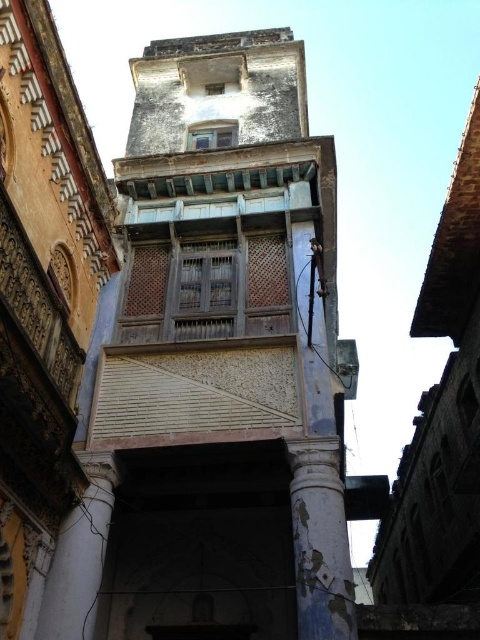
The image size is (480, 640). In order to click on blue painted wood bell tower at center in this screenshot , I will do `click(214, 368)`.

Can you confirm if blue painted wood bell tower at center is thinner than white marble pillar at lower left?

Incorrect, blue painted wood bell tower at center's width is not less than white marble pillar at lower left's.

Is point (218, 616) in front of point (84, 556)?

No, it is behind (84, 556).

Locate an element on the screen. This screenshot has width=480, height=640. blue painted wood bell tower at center is located at coordinates (214, 368).

Does peeling blue paint column at lower right have a greater width compared to white marble pillar at lower left?

Correct, the width of peeling blue paint column at lower right exceeds that of white marble pillar at lower left.

Is peeling blue paint column at lower right taller than white marble pillar at lower left?

Indeed, peeling blue paint column at lower right has a greater height compared to white marble pillar at lower left.

Which is in front, point (321, 605) or point (76, 508)?

Point (321, 605)

Where is `peeling blue paint column at lower right`? The height and width of the screenshot is (640, 480). peeling blue paint column at lower right is located at coordinates (320, 540).

Between blue painted wood bell tower at center and peeling blue paint column at lower right, which one has less height?

Standing shorter between the two is peeling blue paint column at lower right.

Is point (315, 138) positioned after point (296, 529)?

Yes, it is.

Which is behind, point (44, 624) or point (313, 472)?

The point (313, 472) is more distant.

The width and height of the screenshot is (480, 640). I want to click on blue painted wood bell tower at center, so click(214, 368).